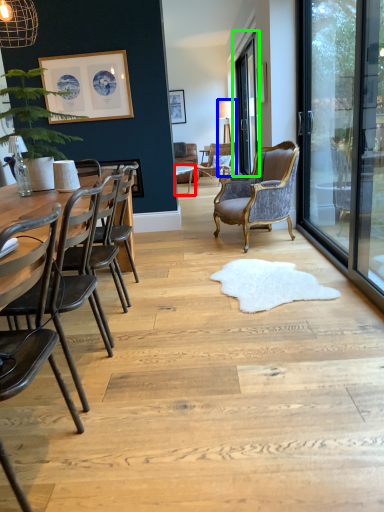
Question: Based on their relative distances, which object is farther from round table (highlighted by a red box)? Choose from lamp (highlighted by a blue box) and window screen (highlighted by a green box).

Choices:
 (A) lamp
 (B) window screen

Answer: (B)